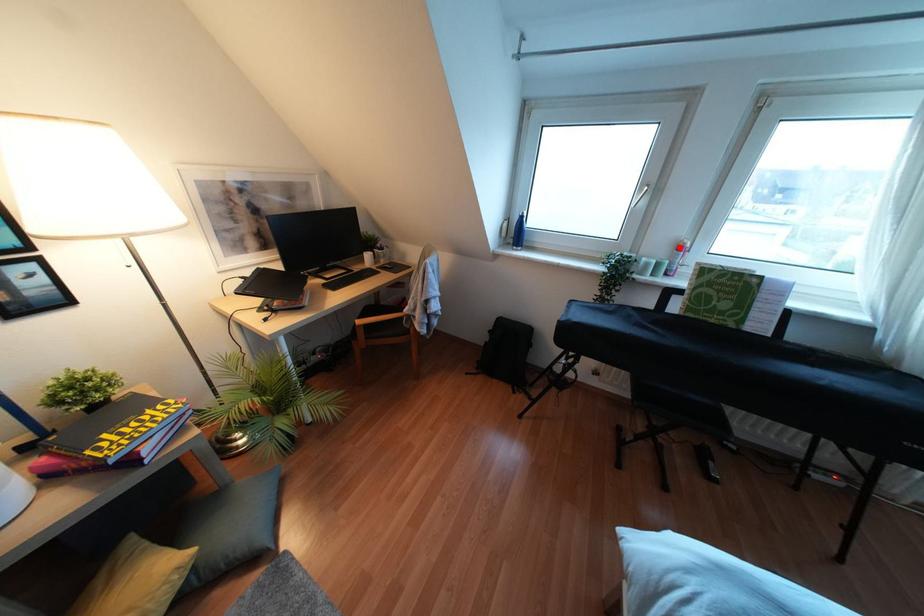
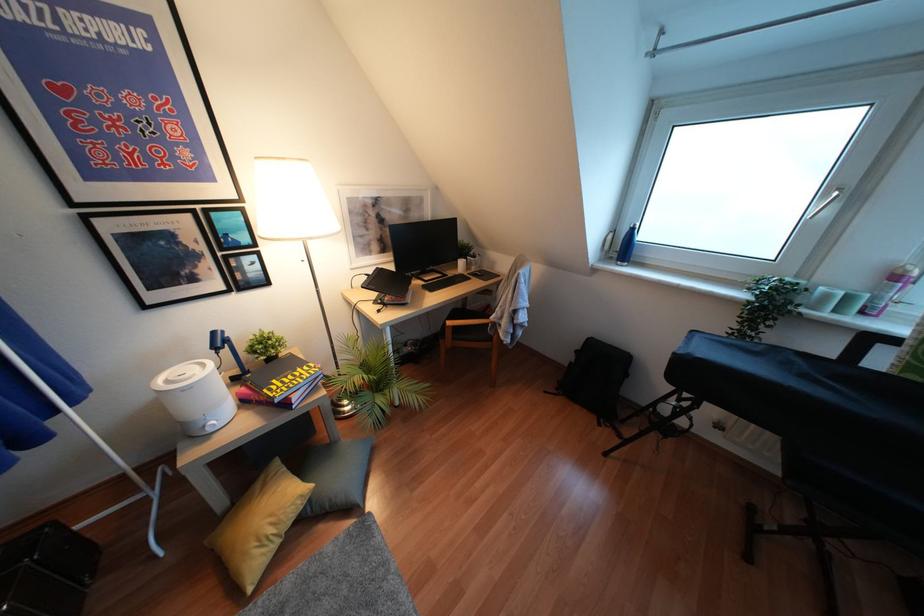
Question: I am providing you with two images of the same scene from different viewpoints. Image1 has a red point marked. In image2, the corresponding 3D location appears at what relative position? Reply with the corresponding letter.

Choices:
 (A) Closer
 (B) Farther

Answer: (B)